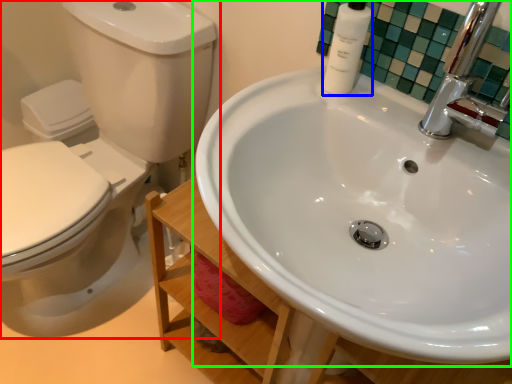
Question: Which object is positioned farthest from toilet (highlighted by a red box)? Select from toiletry (highlighted by a blue box) and sink (highlighted by a green box).

Choices:
 (A) toiletry
 (B) sink

Answer: (A)